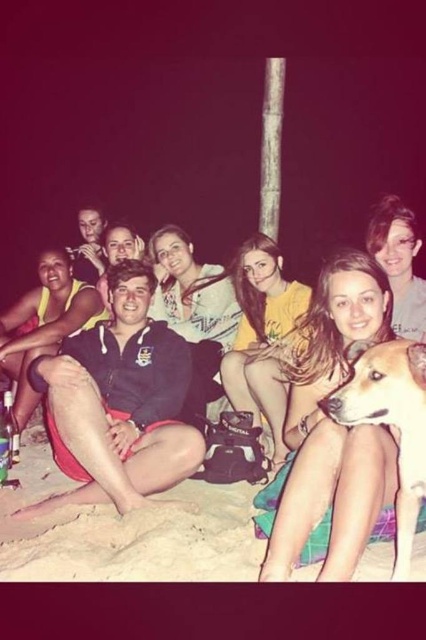
You are a photographer trying to capture a group photo of the scene. You notice two jackets labeled as matte black jacket at center and black matte jacket at center. Which jacket should you focus on if you want to capture the smaller one?

The matte black jacket at center is smaller compared to the black matte jacket at center, so you should focus on the matte black jacket at center to capture the smaller one.

You are a photographer trying to capture a clear shot of the black matte jacket at center and the sandy beach at lower center. Since the jacket is thinner than the sandy beach, which object should you focus on first to ensure both are in focus?

The black matte jacket at center is thinner than the sandy beach at lower center, so you should focus on the black matte jacket at center first to ensure both are in focus.